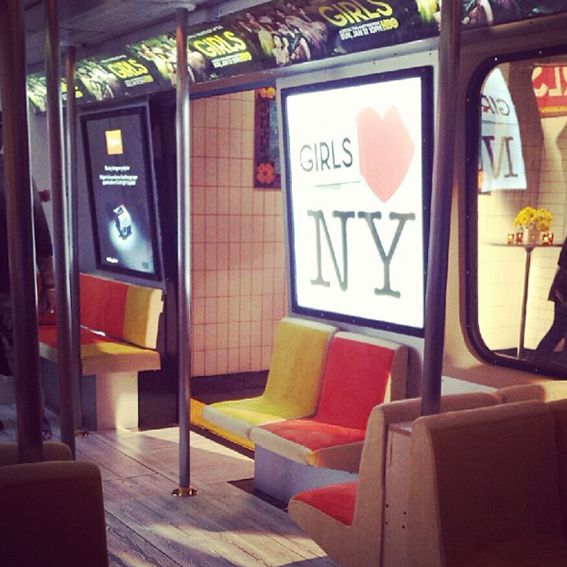
Locate an element on the screen. window is located at coordinates coord(523,204).